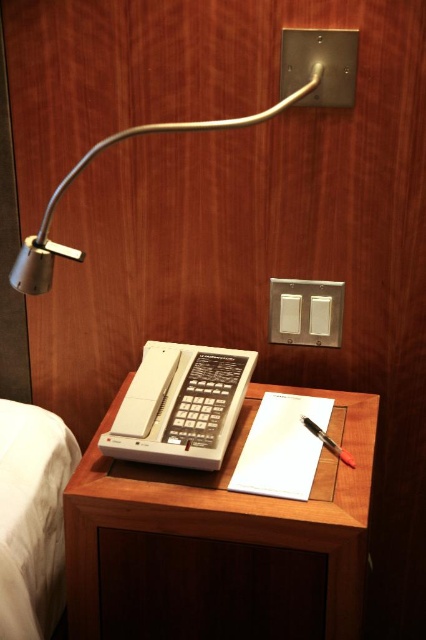
You are a guest in a hotel room and want to turn on the light. You see the white fabric bed at lower left and the satin silver lamp at upper center. Which object should you interact with to illuminate the room?

The satin silver lamp at upper center should be interacted with to illuminate the room, as it is a lamp designed to provide light.

You are trying to place a small decorative item on the wooden table at center and the black plastic pen at center. Which surface can accommodate the item if it needs to be placed higher up?

The wooden table at center has a greater height compared to the black plastic pen at center, so the item should be placed on the wooden table at center to achieve a higher position.

You are trying to reach the satin silver lamp at upper center to adjust its light. However, the white plastic phone at center is blocking your access. Based on the scene, can you determine if you can move the phone to the left to make space?

The white plastic phone at center is positioned on the right side of the satin silver lamp at upper center. Moving the phone to the left would place it closer to the lamp, which might not provide enough space. Consider moving it further away from the lamp instead.